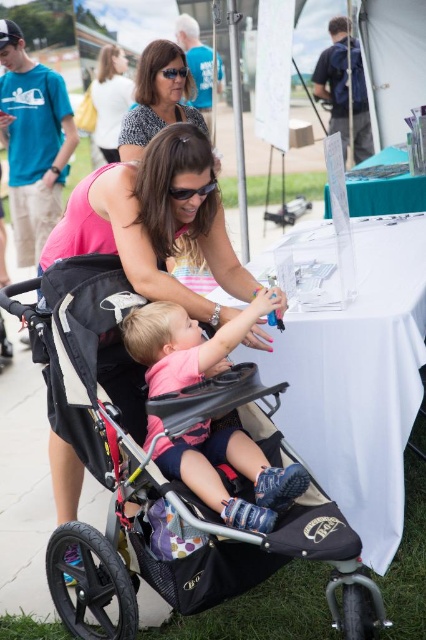
Question: Is black fabric stroller at center thinner than matte black stroller at upper center?

Choices:
 (A) yes
 (B) no

Answer: (B)

Question: Is the position of pink matte shirt at center more distant than that of matte black stroller at upper center?

Choices:
 (A) yes
 (B) no

Answer: (B)

Question: Which point is farther to the camera?

Choices:
 (A) pink matte shirt at center
 (B) pink fabric at center

Answer: (B)

Question: Based on their relative distances, which object is farther from the pink matte shirt at center?

Choices:
 (A) matte black stroller at upper center
 (B) matte pink shirt at upper center
 (C) black fabric stroller at center
 (D) pink fabric at center

Answer: (A)

Question: Does pink fabric at center appear on the left side of matte black stroller at upper center?

Choices:
 (A) yes
 (B) no

Answer: (B)

Question: Based on their relative distances, which object is nearer to the black fabric stroller at center?

Choices:
 (A) matte black stroller at upper center
 (B) matte pink shirt at upper center
 (C) pink matte shirt at center

Answer: (C)